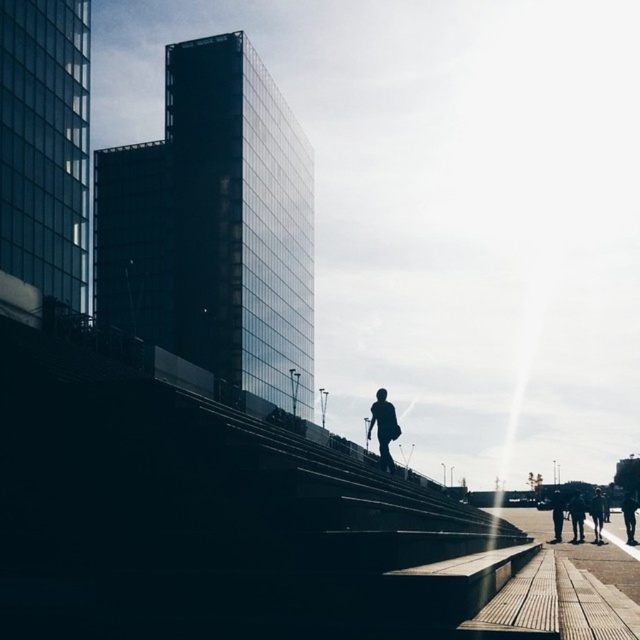
Between wooden planks at lower right and dark blue jeans at lower right, which one appears on the right side from the viewer's perspective?

dark blue jeans at lower right

Identify the location of wooden planks at lower right. [605, 557].

Is point (621, 570) farther from viewer compared to point (561, 518)?

No, (621, 570) is closer to viewer.

The height and width of the screenshot is (640, 640). In order to click on wooden planks at lower right in this screenshot , I will do `click(605, 557)`.

Between green fabric pants at lower right and dark blue jeans at lower right, which one has less height?

green fabric pants at lower right is shorter.

Which is behind, point (572, 493) or point (561, 497)?

Positioned behind is point (572, 493).

The height and width of the screenshot is (640, 640). I want to click on green fabric pants at lower right, so click(577, 516).

Does dark gray uniform at lower right have a larger size compared to dark blue jeans at lower right?

Yes.

Identify the location of dark gray uniform at lower right. The image size is (640, 640). (596, 515).